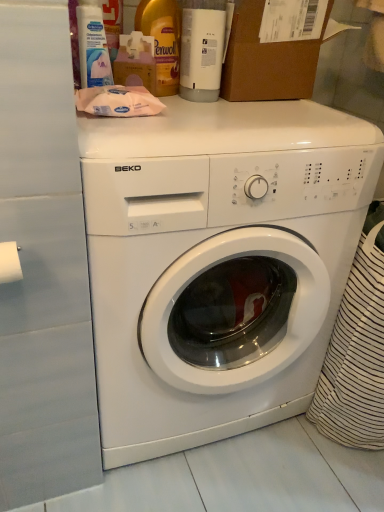
What do you see at coordinates (10, 262) in the screenshot? Image resolution: width=384 pixels, height=512 pixels. I see `white matte toilet paper at left` at bounding box center [10, 262].

The height and width of the screenshot is (512, 384). What do you see at coordinates (216, 258) in the screenshot?
I see `white glossy washing machine at center` at bounding box center [216, 258].

Image resolution: width=384 pixels, height=512 pixels. What do you see at coordinates (162, 40) in the screenshot? I see `yellow plastic bottle at upper center, which ranks as the 1th bottle in left-to-right order` at bounding box center [162, 40].

In order to face white plastic bottle at upper left, should I rotate leftwards or rightwards?

A 13.363 degree turn to the left will do.

Identify the location of brown cardboard box at upper center. This screenshot has height=512, width=384. (267, 60).

From the image's perspective, is white glossy washing machine at center located above or below brown cardboard box at upper center?

Based on their image positions, white glossy washing machine at center is located beneath brown cardboard box at upper center.

How many degrees apart are the facing directions of white glossy washing machine at center and brown cardboard box at upper center?

1.32 degrees.

Could you tell me if white glossy washing machine at center is facing brown cardboard box at upper center?

No, white glossy washing machine at center is not oriented towards brown cardboard box at upper center.

Does white glossy washing machine at center come in front of brown cardboard box at upper center?

That is True.

From the image's perspective, which one is positioned higher, white plastic bottle at upper center, which ranks as the first bottle in right-to-left order, or white matte toilet paper at left?

white plastic bottle at upper center, which ranks as the first bottle in right-to-left order, is shown above in the image.

From a real-world perspective, is white plastic bottle at upper center, acting as the second bottle starting from the left, physically located above or below white matte toilet paper at left?

Clearly, from a real-world perspective, white plastic bottle at upper center, acting as the second bottle starting from the left, is above white matte toilet paper at left.

Considering the sizes of objects white plastic bottle at upper center, which ranks as the first bottle in right-to-left order, and white matte toilet paper at left in the image provided, who is thinner, white plastic bottle at upper center, which ranks as the first bottle in right-to-left order, or white matte toilet paper at left?

Thinner between the two is white matte toilet paper at left.

Is white plastic bottle at upper center, acting as the second bottle starting from the left, not close to white matte toilet paper at left?

Actually, white plastic bottle at upper center, acting as the second bottle starting from the left, and white matte toilet paper at left are a little close together.

This screenshot has width=384, height=512. In order to click on cleaning product below the brown cardboard box at upper center (from the image's perspective) in this screenshot , I will do `click(93, 47)`.

Could you tell me if brown cardboard box at upper center is facing white plastic bottle at upper left?

No, brown cardboard box at upper center is not aimed at white plastic bottle at upper left.

Is white matte toilet paper at left at the left side of white glossy washing machine at center?

Correct, you'll find white matte toilet paper at left to the left of white glossy washing machine at center.

Does white matte toilet paper at left contain white glossy washing machine at center?

No, white glossy washing machine at center is located outside of white matte toilet paper at left.

From a real-world perspective, which is physically below, white matte toilet paper at left or white glossy washing machine at center?

white glossy washing machine at center is physically lower.

Is white plastic bottle at upper center, acting as the second bottle starting from the left, far from yellow plastic bottle at upper center, the 2th bottle from the right?

They are positioned close to each other.

From the image's perspective, which one is positioned higher, white plastic bottle at upper center, which ranks as the first bottle in right-to-left order, or yellow plastic bottle at upper center, the 2th bottle from the right?

yellow plastic bottle at upper center, the 2th bottle from the right, from the image's perspective.

Would you say white plastic bottle at upper center, acting as the second bottle starting from the left, is inside or outside yellow plastic bottle at upper center, the 2th bottle from the right?

white plastic bottle at upper center, acting as the second bottle starting from the left, is spatially situated outside yellow plastic bottle at upper center, the 2th bottle from the right.

Looking at this image, who is smaller, yellow plastic bottle at upper center, which ranks as the 1th bottle in left-to-right order, or white glossy washing machine at center?

yellow plastic bottle at upper center, which ranks as the 1th bottle in left-to-right order, is smaller.

Is yellow plastic bottle at upper center, which ranks as the 1th bottle in left-to-right order, outside of white glossy washing machine at center?

Yes, yellow plastic bottle at upper center, which ranks as the 1th bottle in left-to-right order, is outside of white glossy washing machine at center.

Which of these two, yellow plastic bottle at upper center, which ranks as the 1th bottle in left-to-right order, or white glossy washing machine at center, stands shorter?

With less height is yellow plastic bottle at upper center, which ranks as the 1th bottle in left-to-right order.

How different are the orientations of yellow plastic bottle at upper center, the 2th bottle from the right, and white plastic bottle at upper left in degrees?

1.45 degrees separate the facing orientations of yellow plastic bottle at upper center, the 2th bottle from the right, and white plastic bottle at upper left.

Is yellow plastic bottle at upper center, which ranks as the 1th bottle in left-to-right order, located outside white plastic bottle at upper left?

yellow plastic bottle at upper center, which ranks as the 1th bottle in left-to-right order, lies outside white plastic bottle at upper left's area.

Looking at their sizes, would you say yellow plastic bottle at upper center, which ranks as the 1th bottle in left-to-right order, is wider or thinner than white plastic bottle at upper left?

Clearly, yellow plastic bottle at upper center, which ranks as the 1th bottle in left-to-right order, has more width compared to white plastic bottle at upper left.

At what (x,y) coordinates should I click in order to perform the action: click on cleaning product in front of the yellow plastic bottle at upper center, the 2th bottle from the right. Please return your answer as a coordinate pair (x, y). Looking at the image, I should click on (93, 47).

The width and height of the screenshot is (384, 512). Identify the location of cardboard box that appears above the white glossy washing machine at center (from a real-world perspective). (267, 60).

From the white matte toilet paper at left, count 2nd bottle to the right and point to it. Please provide its 2D coordinates.

[(202, 49)]

Looking at the image, which one is located further to white matte toilet paper at left, white glossy washing machine at center or brown cardboard box at upper center?

Among the two, brown cardboard box at upper center is located further to white matte toilet paper at left.

From the image, which object appears to be nearer to yellow plastic bottle at upper center, which ranks as the 1th bottle in left-to-right order, white matte toilet paper at left or white plastic bottle at upper left?

white plastic bottle at upper left is positioned closer to the anchor yellow plastic bottle at upper center, which ranks as the 1th bottle in left-to-right order.

Based on their spatial positions, is white plastic bottle at upper left or brown cardboard box at upper center closer to white plastic bottle at upper center, acting as the second bottle starting from the left?

brown cardboard box at upper center is closer to white plastic bottle at upper center, acting as the second bottle starting from the left.

Considering their positions, is brown cardboard box at upper center positioned further to yellow plastic bottle at upper center, the 2th bottle from the right, than white plastic bottle at upper left?

brown cardboard box at upper center lies further to yellow plastic bottle at upper center, the 2th bottle from the right, than the other object.

Estimate the real-world distances between objects in this image. Which object is closer to brown cardboard box at upper center, white matte toilet paper at left or white glossy washing machine at center?

The object closer to brown cardboard box at upper center is white glossy washing machine at center.

When comparing their distances from white plastic bottle at upper left, does white plastic bottle at upper center, which ranks as the first bottle in right-to-left order, or brown cardboard box at upper center seem further?

brown cardboard box at upper center is further to white plastic bottle at upper left.

From the image, which object appears to be nearer to white plastic bottle at upper left, yellow plastic bottle at upper center, which ranks as the 1th bottle in left-to-right order, or white glossy washing machine at center?

yellow plastic bottle at upper center, which ranks as the 1th bottle in left-to-right order, lies closer to white plastic bottle at upper left than the other object.

Which object lies further to the anchor point white plastic bottle at upper left, yellow plastic bottle at upper center, the 2th bottle from the right, or white plastic bottle at upper center, which ranks as the first bottle in right-to-left order?

white plastic bottle at upper center, which ranks as the first bottle in right-to-left order.

Identify the location of washing machine between brown cardboard box at upper center and white matte toilet paper at left in the up-down direction. click(216, 258).

Where is `bottle between yellow plastic bottle at upper center, which ranks as the 1th bottle in left-to-right order, and white matte toilet paper at left in the up-down direction`? This screenshot has width=384, height=512. bottle between yellow plastic bottle at upper center, which ranks as the 1th bottle in left-to-right order, and white matte toilet paper at left in the up-down direction is located at coordinates (202, 49).

Image resolution: width=384 pixels, height=512 pixels. I want to click on bottle between yellow plastic bottle at upper center, the 2th bottle from the right, and brown cardboard box at upper center, so click(202, 49).

Locate an element on the screen. washing machine between yellow plastic bottle at upper center, the 2th bottle from the right, and white matte toilet paper at left vertically is located at coordinates (216, 258).